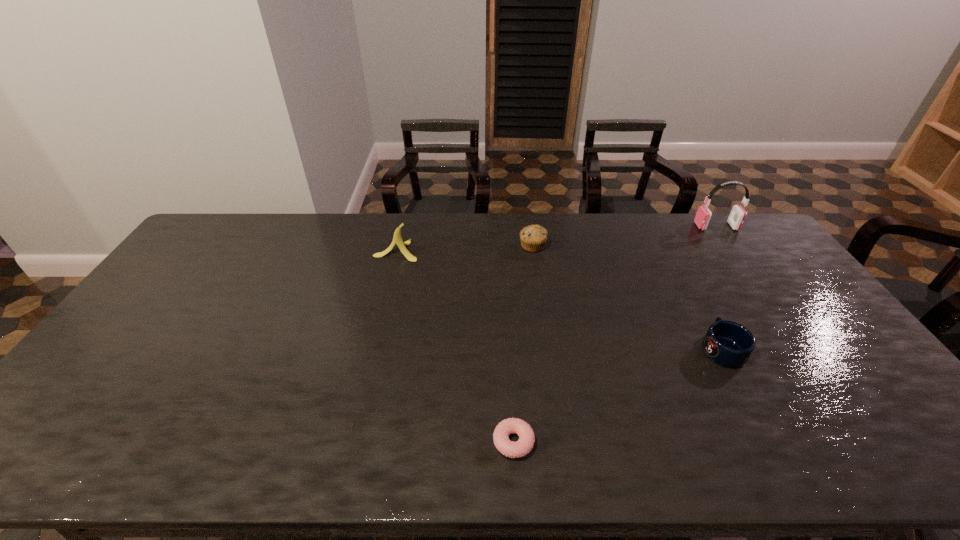
You are a GUI agent. You are given a task and a screenshot of the screen. Output one action in this format:
    pyautogui.click(x=<x>, y=<y>)
    Task: Click on the blank space located on the outer surface of the farthest object
    Image resolution: width=960 pixels, height=540 pixels.
    Given the screenshot: What is the action you would take?
    pyautogui.click(x=614, y=226)

In order to click on vacant region located on the outer surface of the farthest object in this screenshot , I will do `click(622, 226)`.

The height and width of the screenshot is (540, 960). Find the location of `blank space located 0.080m on the right of the banana`. blank space located 0.080m on the right of the banana is located at coordinates (442, 251).

Find the location of a particular element. The height and width of the screenshot is (540, 960). blank space located 0.080m on the left of the muffin is located at coordinates (496, 246).

The image size is (960, 540). Find the location of `free spot located with the handle on the side of the fourth object from left to right`. free spot located with the handle on the side of the fourth object from left to right is located at coordinates (699, 305).

What are the coordinates of `free region located 0.290m with the handle on the side of the fourth object from left to right` in the screenshot? It's located at (678, 266).

Locate an element on the screen. This screenshot has width=960, height=540. free location located with the handle on the side of the fourth object from left to right is located at coordinates (679, 268).

Locate an element on the screen. free point located on the right of the doughnut is located at coordinates (587, 442).

At what (x,y) coordinates should I click in order to perform the action: click on earphone at the far edge. Please return your answer as a coordinate pair (x, y). This screenshot has width=960, height=540. Looking at the image, I should click on (737, 216).

Locate an element on the screen. This screenshot has width=960, height=540. banana that is at the far edge is located at coordinates [397, 239].